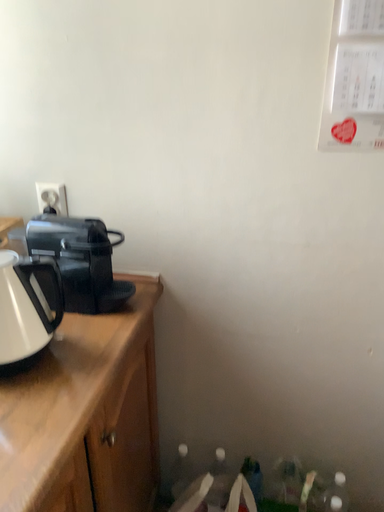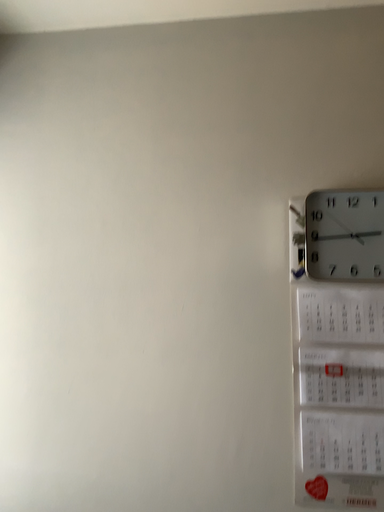
Question: How did the camera likely rotate when shooting the video?

Choices:
 (A) rotated upward
 (B) rotated downward

Answer: (A)